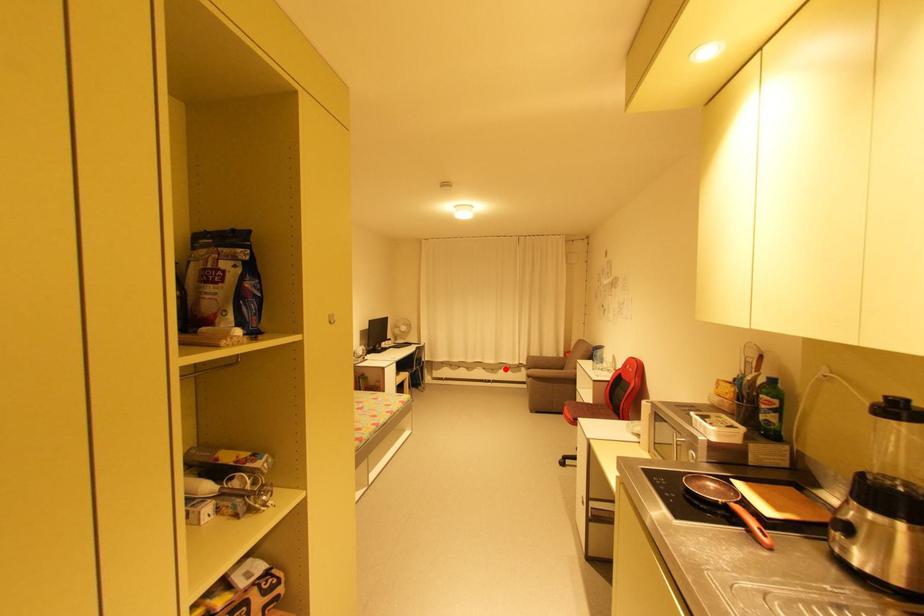
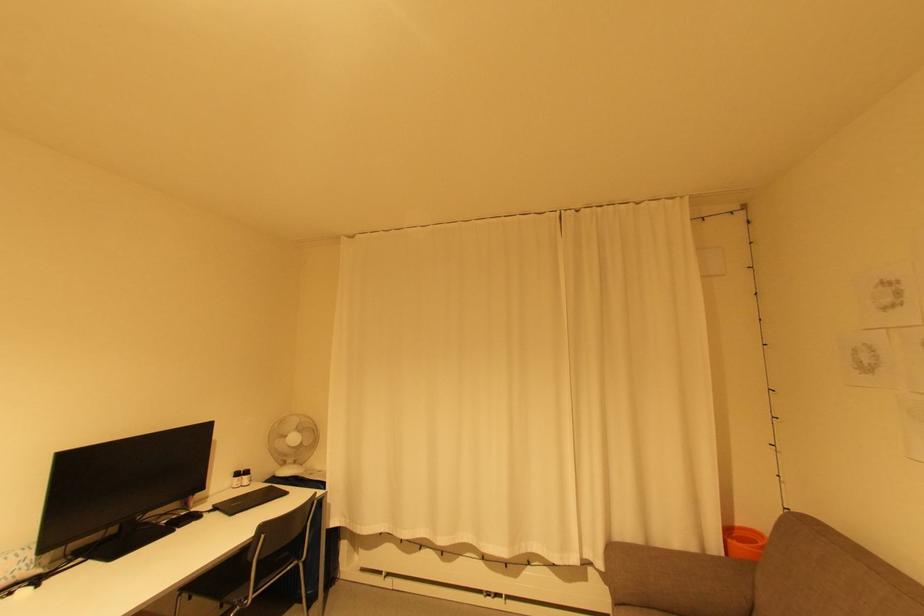
The point at the highlighted location is marked in the first image. Where is the corresponding point in the second image?

(533, 564)